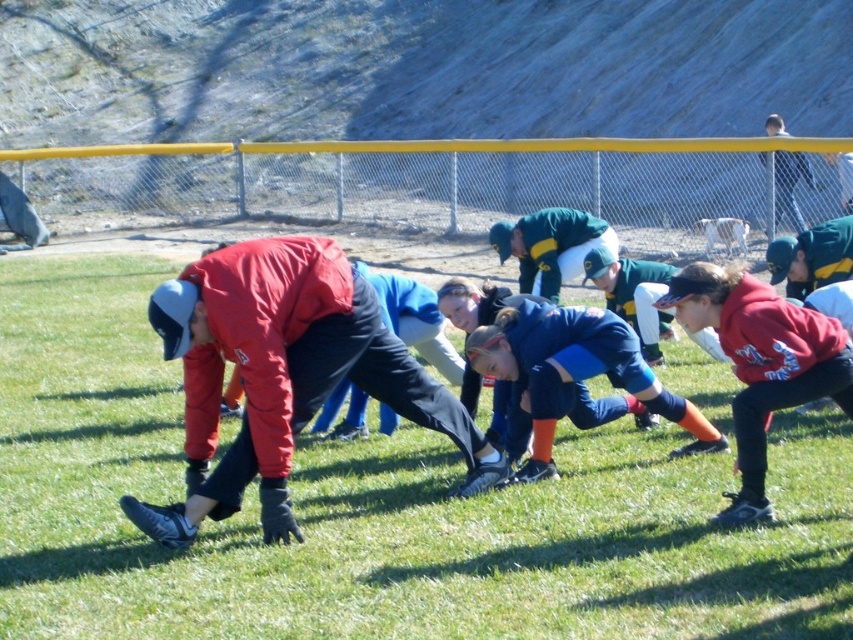
Between green grass at center and matte red hoodie at right, which one has more height?

With more height is green grass at center.

Does point (793, 618) lie behind point (722, 333)?

No, it is not.

Locate an element on the screen. green grass at center is located at coordinates (376, 509).

Which is behind, point (815, 563) or point (242, 426)?

Positioned behind is point (242, 426).

Describe the element at coordinates (376, 509) in the screenshot. I see `green grass at center` at that location.

Where is `green grass at center`? green grass at center is located at coordinates (376, 509).

Does matte red jacket at center come in front of matte red hoodie at right?

No, matte red jacket at center is behind matte red hoodie at right.

Does matte red jacket at center appear over matte red hoodie at right?

Incorrect, matte red jacket at center is not positioned above matte red hoodie at right.

Where is `matte red jacket at center`? matte red jacket at center is located at coordinates (283, 374).